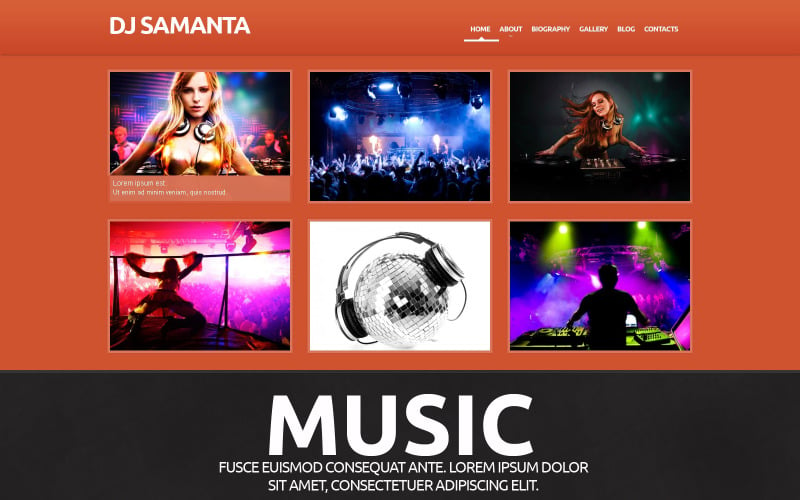
In order to click on green spotlights in this screenshot , I will do `click(553, 248)`, `click(650, 250)`.